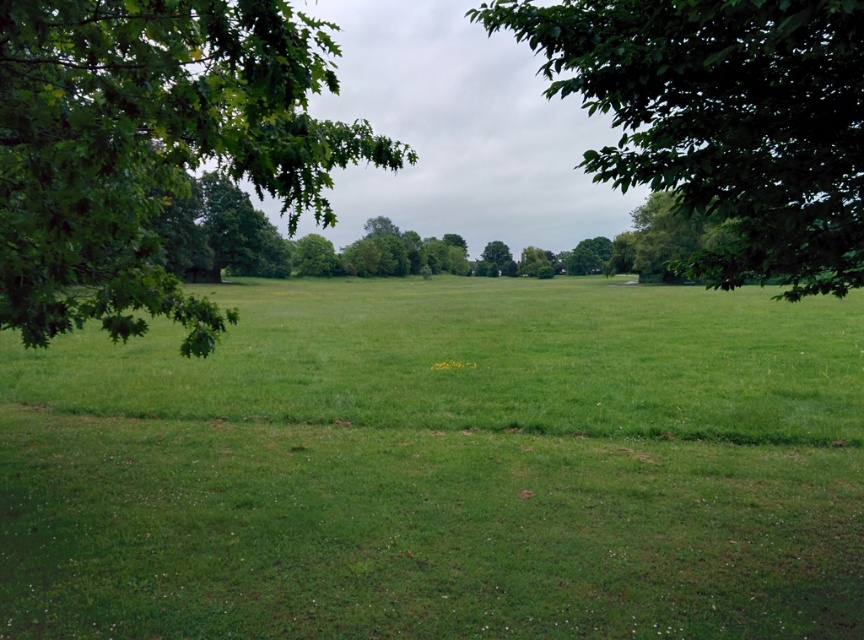
Find the location of a particular element. The height and width of the screenshot is (640, 864). green grass at center is located at coordinates (442, 467).

Does green grass at center come in front of green leafy tree at center?

Yes, green grass at center is closer to the viewer.

Between point (627, 452) and point (496, 241), which one is positioned behind?

Positioned behind is point (496, 241).

Where is `green grass at center`? The image size is (864, 640). green grass at center is located at coordinates (442, 467).

Is green grass at center behind green leafy tree at left?

Yes, it is.

Does green grass at center have a lesser height compared to green leafy tree at left?

Indeed, green grass at center has a lesser height compared to green leafy tree at left.

Which is in front, point (738, 600) or point (43, 28)?

Point (43, 28)

Identify the location of green grass at center. (442, 467).

Between green leafy tree at left and green leafy tree at center, which one appears on the left side from the viewer's perspective?

Positioned to the left is green leafy tree at left.

Can you confirm if green leafy tree at left is positioned to the right of green leafy tree at center?

In fact, green leafy tree at left is to the left of green leafy tree at center.

What do you see at coordinates (150, 147) in the screenshot? Image resolution: width=864 pixels, height=640 pixels. I see `green leafy tree at left` at bounding box center [150, 147].

This screenshot has width=864, height=640. In order to click on green leafy tree at left in this screenshot , I will do `click(150, 147)`.